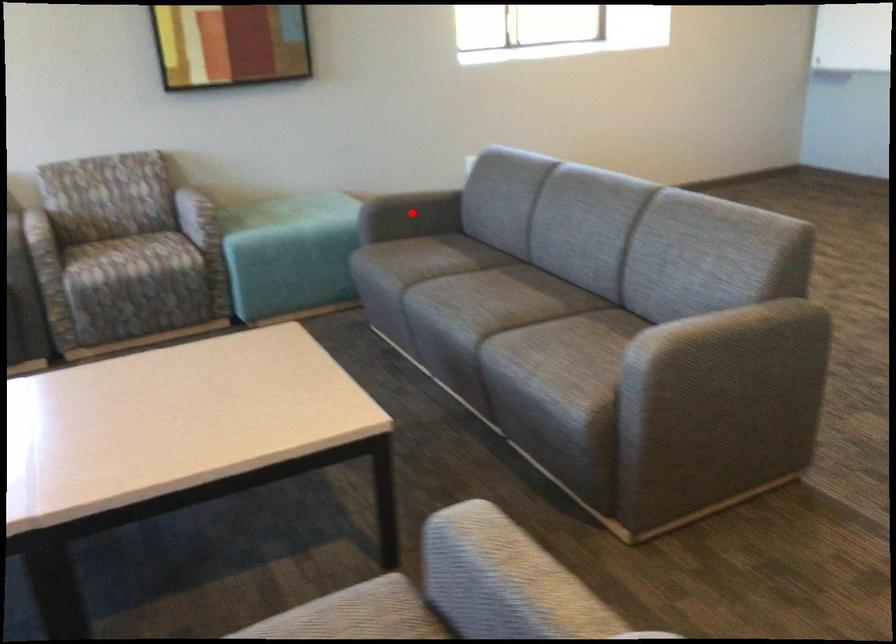
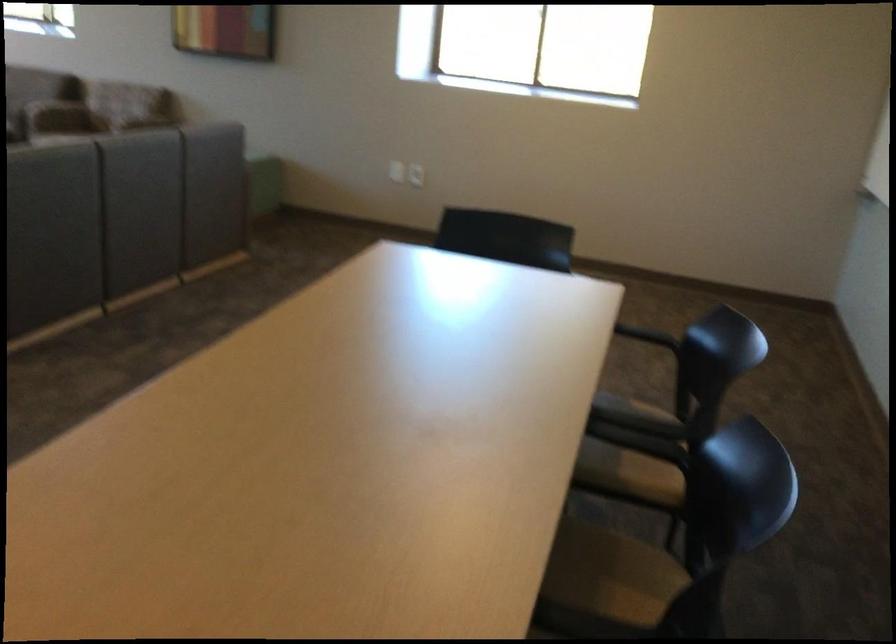
Question: I am providing you with two images of the same scene from different viewpoints. A red point is marked on the first image. Can you still see the location of the red point in image 2?

Choices:
 (A) Yes
 (B) No

Answer: (B)